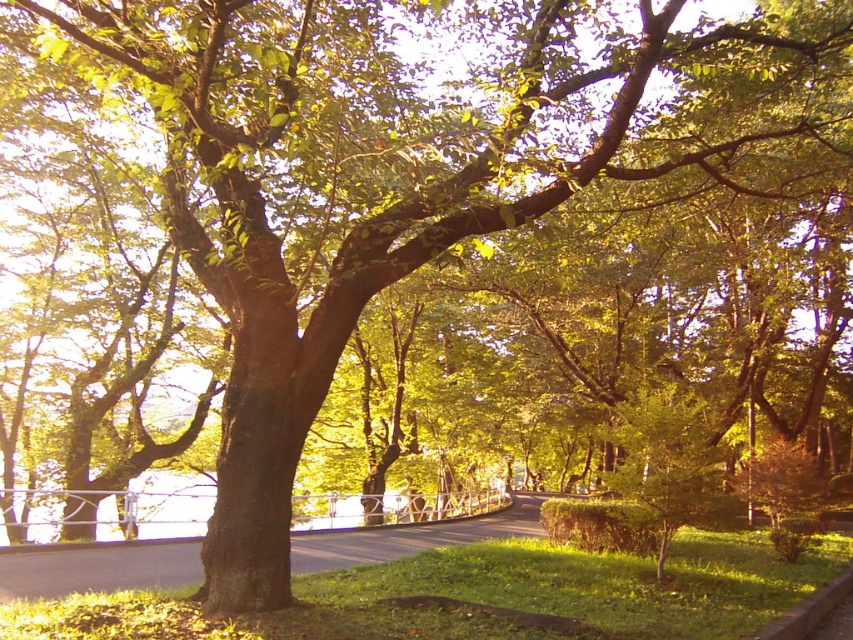
You are a gardener who needs to water the green grass at center and the concrete curb at lower right. Since the water hose is located at the lower left corner, which object should you water first to save time?

The green grass at center should be watered first because it is closer to the water hose located at the lower left corner compared to the concrete curb at lower right, which is further away.

You are a gardener standing at the edge of the green grass at center and the concrete curb at lower right. You need to place a decorative stone between them. Which object should the stone be closer to if it needs to be placed closer to the viewer?

The stone should be placed closer to the green grass at center because it is closer to the viewer than the concrete curb at lower right.